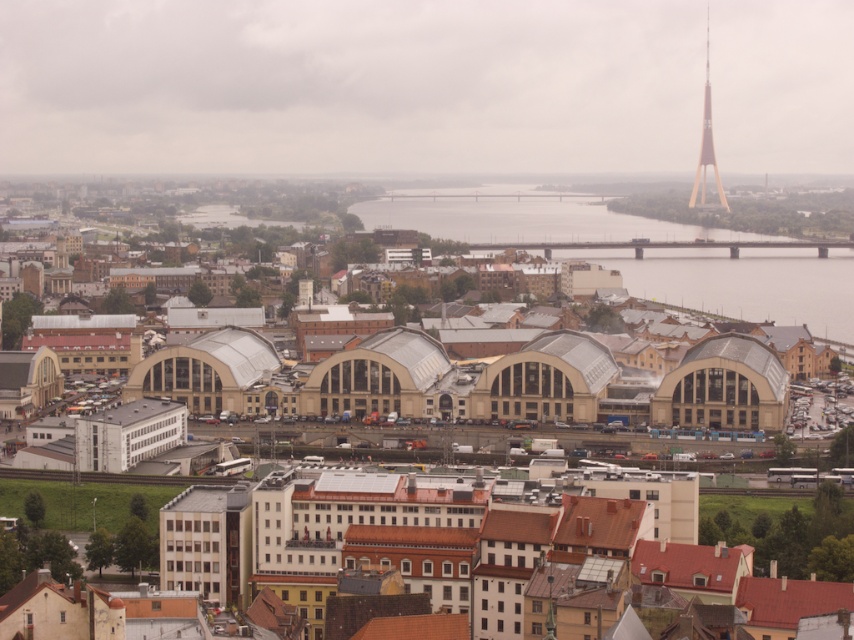
Question: Does gray concrete water at center appear on the right side of metallic gold tower at upper right?

Choices:
 (A) yes
 (B) no

Answer: (B)

Question: Can you confirm if gray concrete water at center is thinner than metallic gold tower at upper right?

Choices:
 (A) yes
 (B) no

Answer: (B)

Question: Which point appears farthest from the camera in this image?

Choices:
 (A) (718, 177)
 (B) (686, 232)

Answer: (A)

Question: Can you confirm if gray concrete water at center is smaller than metallic gold tower at upper right?

Choices:
 (A) yes
 (B) no

Answer: (B)